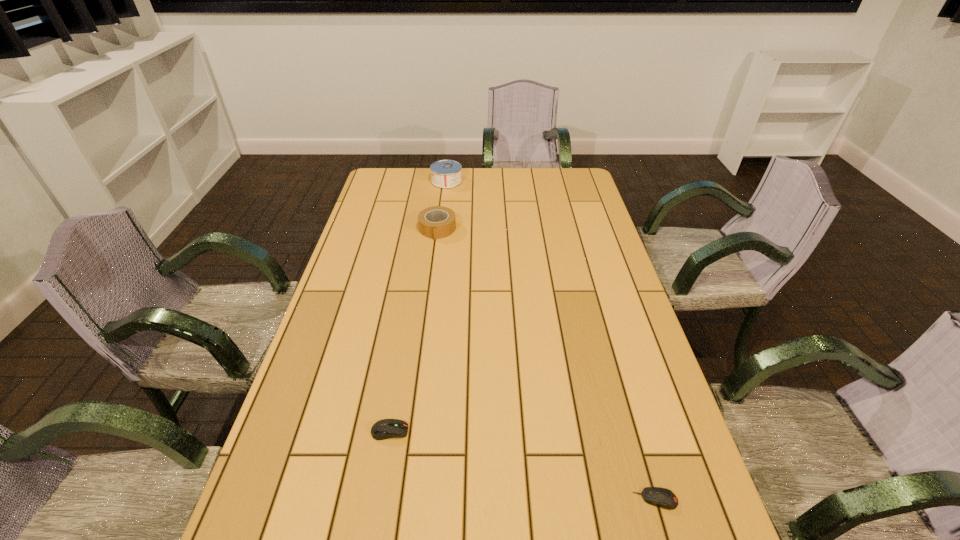
The image size is (960, 540). What are the coordinates of `vacant space located 0.280m on the button of the taller computer mouse` in the screenshot? It's located at (534, 431).

The image size is (960, 540). In order to click on free space located on the back of the shorter computer mouse in this screenshot , I will do `click(641, 451)`.

Identify the location of object that is at the far edge. (445, 174).

You are a GUI agent. You are given a task and a screenshot of the screen. Output one action in this format:
    pyautogui.click(x=<x>, y=<y>)
    Task: Click on the object that is at the right edge
    The width and height of the screenshot is (960, 540).
    Given the screenshot: What is the action you would take?
    pyautogui.click(x=661, y=497)

At what (x,y) coordinates should I click in order to perform the action: click on vacant space at the far edge of the desktop. Please return your answer as a coordinate pair (x, y). Looking at the image, I should click on (521, 179).

Identify the location of free space at the left edge of the desktop. The height and width of the screenshot is (540, 960). (351, 276).

At what (x,y) coordinates should I click in order to perform the action: click on vacant space at the right edge. Please return your answer as a coordinate pair (x, y). Looking at the image, I should click on (579, 233).

Identify the location of free space at the far right corner of the desktop. (551, 171).

At what (x,y) coordinates should I click in order to perform the action: click on vacant space in between the duct tape and the farther computer mouse. Please return your answer as a coordinate pair (x, y). This screenshot has width=960, height=540. Looking at the image, I should click on (414, 330).

Where is `empty space that is in between the farther computer mouse and the nearer computer mouse`? empty space that is in between the farther computer mouse and the nearer computer mouse is located at coordinates [x=522, y=465].